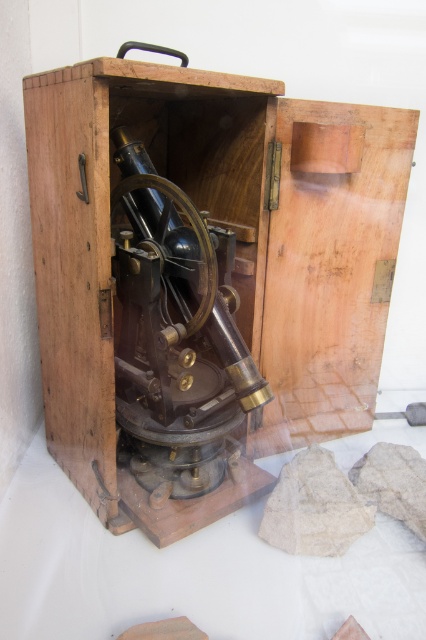
Question: Which point appears closest to the camera in this image?

Choices:
 (A) (316, 404)
 (B) (201, 234)

Answer: (B)

Question: Which object is farther from the camera taking this photo?

Choices:
 (A) wooden box at center
 (B) polished brass telescope at center

Answer: (B)

Question: Does wooden box at center come behind polished brass telescope at center?

Choices:
 (A) yes
 (B) no

Answer: (B)

Question: From the image, what is the correct spatial relationship of wooden box at center in relation to polished brass telescope at center?

Choices:
 (A) left
 (B) right

Answer: (B)

Question: In this image, where is wooden box at center located relative to polished brass telescope at center?

Choices:
 (A) above
 (B) below

Answer: (A)